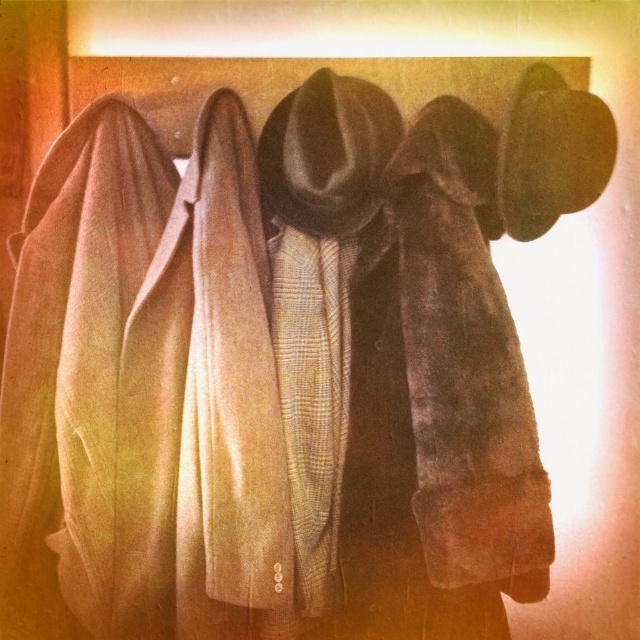
Question: Is brown fur scarf at center closer to camera compared to plaid wool scarf at center?

Choices:
 (A) no
 (B) yes

Answer: (B)

Question: Considering the relative positions of brown fur scarf at center and plaid wool scarf at center in the image provided, where is brown fur scarf at center located with respect to plaid wool scarf at center?

Choices:
 (A) left
 (B) right

Answer: (B)

Question: Is brown fur scarf at center further to camera compared to plaid wool scarf at center?

Choices:
 (A) yes
 (B) no

Answer: (B)